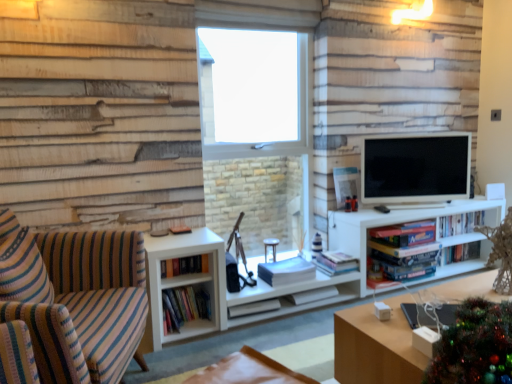
Question: From a real-world perspective, is white matte book at center, the seventh book in the right-to-left sequence, located beneath hardcover books at center, which appears as the 3th book when viewed from the right?

Choices:
 (A) no
 (B) yes

Answer: (B)

Question: Is white matte book at center, which is counted as the 3th book, starting from the left, further to the viewer compared to hardcover books at center, which appears as the 3th book when viewed from the right?

Choices:
 (A) yes
 (B) no

Answer: (B)

Question: Is white matte book at center, which is counted as the 3th book, starting from the left, surrounding hardcover books at center, which appears as the 3th book when viewed from the right?

Choices:
 (A) yes
 (B) no

Answer: (B)

Question: Does white matte book at center, which is counted as the 3th book, starting from the left, have a lesser width compared to hardcover books at center, placed as the 7th book when sorted from left to right?

Choices:
 (A) yes
 (B) no

Answer: (A)

Question: Is white matte book at center, which is counted as the 3th book, starting from the left, shorter than hardcover books at center, placed as the 7th book when sorted from left to right?

Choices:
 (A) yes
 (B) no

Answer: (A)

Question: Is white matte entertainment center at center inside or outside of striped fabric couch at left?

Choices:
 (A) inside
 (B) outside

Answer: (B)

Question: Is white matte entertainment center at center wider or thinner than striped fabric couch at left?

Choices:
 (A) wide
 (B) thin

Answer: (B)

Question: Based on their positions, is white matte entertainment center at center located to the left or right of striped fabric couch at left?

Choices:
 (A) right
 (B) left

Answer: (A)

Question: Is point (426, 215) positioned closer to the camera than point (64, 377)?

Choices:
 (A) closer
 (B) farther

Answer: (B)

Question: From their relative heights in the image, would you say hardcover book at center, which is the 5th book from right to left, is taller or shorter than matte black tv at right?

Choices:
 (A) tall
 (B) short

Answer: (B)

Question: From a real-world perspective, is hardcover book at center, which is the 5th book from right to left, physically located above or below matte black tv at right?

Choices:
 (A) below
 (B) above

Answer: (A)

Question: In the image, is hardcover book at center, which is the 5th book from right to left, positioned in front of or behind matte black tv at right?

Choices:
 (A) behind
 (B) front

Answer: (B)

Question: Choose the correct answer: Is hardcover book at center, the fifth book when ordered from left to right, inside matte black tv at right or outside it?

Choices:
 (A) inside
 (B) outside

Answer: (B)

Question: Is point (357, 367) closer or farther from the camera than point (275, 291)?

Choices:
 (A) farther
 (B) closer

Answer: (B)

Question: From the image's perspective, relative to white matte entertainment center at center, is wooden table at lower right above or below?

Choices:
 (A) below
 (B) above

Answer: (A)